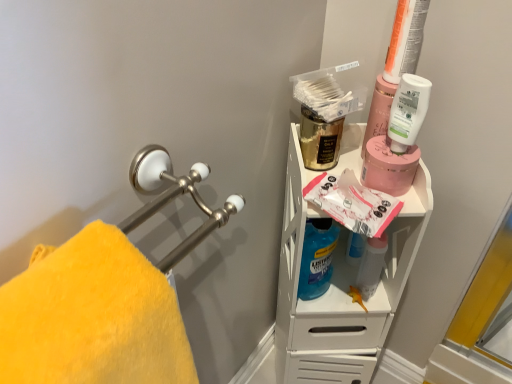
Question: From a real-world perspective, is blue translucent liquid at center, marked as the second cleaning product in a bottom-to-top arrangement, physically below pink matte jar at upper right?

Choices:
 (A) no
 (B) yes

Answer: (B)

Question: Is blue translucent liquid at center, the first cleaning product positioned from the left, shorter than pink matte jar at upper right?

Choices:
 (A) no
 (B) yes

Answer: (A)

Question: Does blue translucent liquid at center, marked as the second cleaning product in a bottom-to-top arrangement, have a greater height compared to pink matte jar at upper right?

Choices:
 (A) no
 (B) yes

Answer: (B)

Question: Is blue translucent liquid at center, which is the 2th cleaning product from top to bottom, to the right of pink matte jar at upper right from the viewer's perspective?

Choices:
 (A) no
 (B) yes

Answer: (A)

Question: Considering the relative sizes of blue translucent liquid at center, which is the 2th cleaning product from top to bottom, and pink matte jar at upper right in the image provided, is blue translucent liquid at center, which is the 2th cleaning product from top to bottom, thinner than pink matte jar at upper right?

Choices:
 (A) no
 (B) yes

Answer: (B)

Question: Considering the relative positions of blue translucent liquid at center, the third cleaning product from the right, and pink matte jar at upper right in the image provided, is blue translucent liquid at center, the third cleaning product from the right, in front of pink matte jar at upper right?

Choices:
 (A) yes
 (B) no

Answer: (B)

Question: From a real-world perspective, is gold metallic mouthwash at upper center, which is the second mouthwash from right to left, below pink matte jar at upper right?

Choices:
 (A) yes
 (B) no

Answer: (B)

Question: Could pink matte jar at upper right be considered to be inside gold metallic mouthwash at upper center, which is the second mouthwash from right to left?

Choices:
 (A) yes
 (B) no

Answer: (B)

Question: From the image's perspective, would you say gold metallic mouthwash at upper center, placed as the 1th mouthwash when sorted from left to right, is shown under pink matte jar at upper right?

Choices:
 (A) yes
 (B) no

Answer: (B)

Question: Does gold metallic mouthwash at upper center, which is the second mouthwash from right to left, come behind pink matte jar at upper right?

Choices:
 (A) no
 (B) yes

Answer: (B)

Question: Is gold metallic mouthwash at upper center, placed as the 1th mouthwash when sorted from left to right, closer to camera compared to pink matte jar at upper right?

Choices:
 (A) no
 (B) yes

Answer: (A)

Question: Does gold metallic mouthwash at upper center, placed as the 1th mouthwash when sorted from left to right, have a lesser height compared to pink matte jar at upper right?

Choices:
 (A) yes
 (B) no

Answer: (B)

Question: Is there a large distance between white matte lotion at upper right, marked as the 3th cleaning product in a bottom-to-top arrangement, and yellow plush towel at left?

Choices:
 (A) no
 (B) yes

Answer: (A)